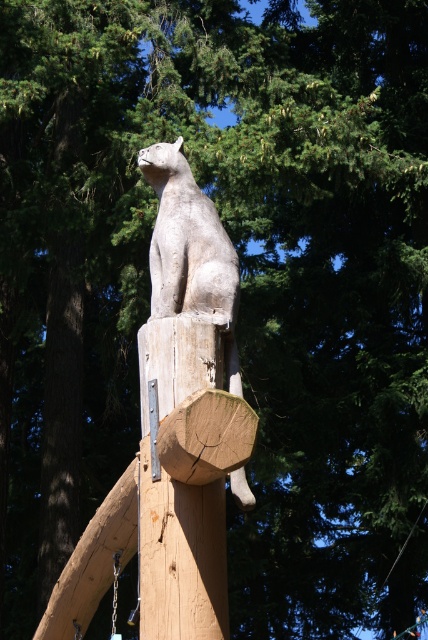
You are an artist who wants to place a new sculpture between the gray wood cat at center and the gray stone cat at center. Since the space between them is 1.2 meters wide, will the new sculpture of 1 meter width fit without overlapping either?

The gray wood cat at center is wider than the gray stone cat at center. Therefore, the total width of both cats combined would be more than 1.2 meters. The new sculpture of 1 meter width may not fit without overlapping either cat.

You are an artist planning to paint the scene. You need to know which object takes up more area in the image. Which one is larger between the dark brown wood at left and the gray stone cat at center?

The gray stone cat at center occupies more space than the dark brown wood at left, so it is the larger object in the image.

You are standing in front of the wooden sculpture of a cat and its structure. There are two points marked on the sculpture. The first point is at coordinate point (175, 266) and the second point is at coordinate point (190, 168). From your perspective, which point is closer to you?

Point (175, 266) is in front of point (190, 168), so it is closer to you.